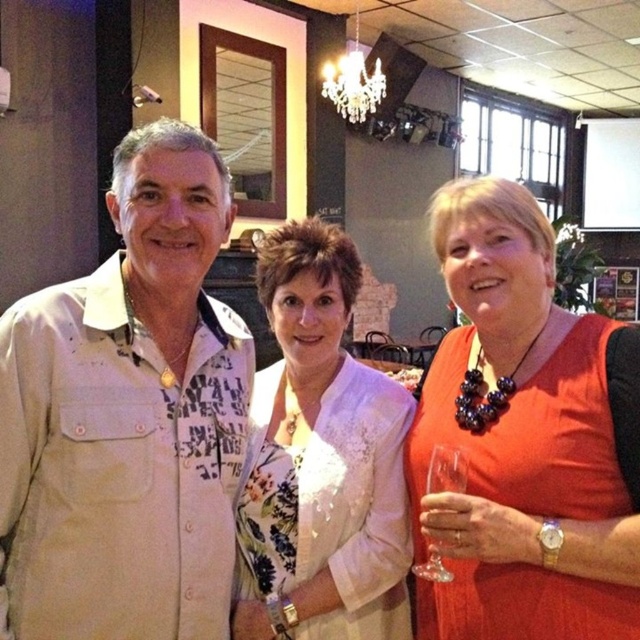
Question: Is beige cotton shirt at center above orange fabric dress at center?

Choices:
 (A) no
 (B) yes

Answer: (B)

Question: Which object appears farthest from the camera in this image?

Choices:
 (A) orange fabric dress at center
 (B) clear glass wine glass at lower right
 (C) beige cotton shirt at center

Answer: (B)

Question: Which object appears farthest from the camera in this image?

Choices:
 (A) clear glass wine glass at lower right
 (B) orange fabric dress at center
 (C) beige cotton shirt at center
 (D) white floral blouse at center

Answer: (D)

Question: Which point appears closest to the camera in this image?

Choices:
 (A) (356, 404)
 (B) (582, 525)
 (C) (440, 474)
 (D) (77, 554)

Answer: (D)

Question: From the image, what is the correct spatial relationship of orange fabric dress at center in relation to clear glass wine glass at lower right?

Choices:
 (A) right
 (B) left

Answer: (A)

Question: Is beige cotton shirt at center behind clear glass wine glass at lower right?

Choices:
 (A) yes
 (B) no

Answer: (B)